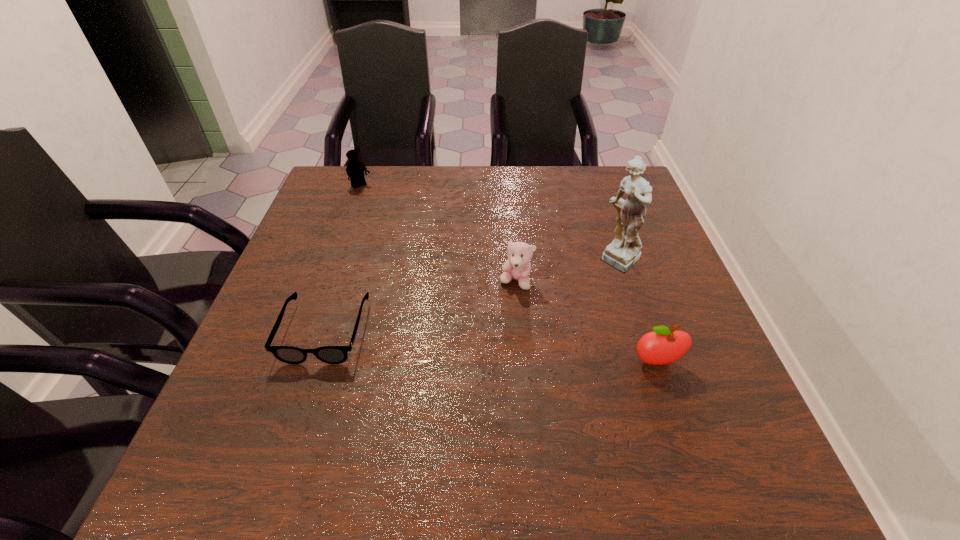
Image resolution: width=960 pixels, height=540 pixels. Find the location of `free space on the desktop that is between the shortest object and the apple and is positioned on the front-facing side of the figurine`. free space on the desktop that is between the shortest object and the apple and is positioned on the front-facing side of the figurine is located at coordinates point(535,350).

Image resolution: width=960 pixels, height=540 pixels. What are the coordinates of `free space on the desktop that is between the spectacles and the apple and is positioned on the front-facing side of the Lego` in the screenshot? It's located at (510, 348).

Find the location of a particular element. free spot on the desktop that is between the spectacles and the apple and is positioned at the face of the teddy bear is located at coordinates (448, 342).